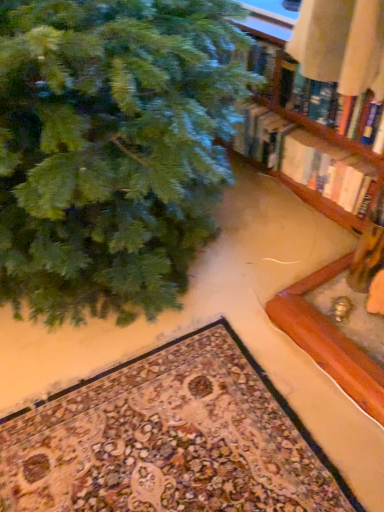
Question: Is point (215, 369) closer or farther from the camera than point (367, 103)?

Choices:
 (A) closer
 (B) farther

Answer: (B)

Question: Is carpeted mat at lower center spatially inside wooden bookshelf at upper right, or outside of it?

Choices:
 (A) inside
 (B) outside

Answer: (B)

Question: Which is farther from the carpeted mat at lower center?

Choices:
 (A) wooden bookshelf at upper right
 (B) green matte christmas tree at upper left
 (C) hardcover book at upper right

Answer: (A)

Question: Which of these objects is positioned closest to the hardcover book at upper right?

Choices:
 (A) wooden bookshelf at upper right
 (B) green matte christmas tree at upper left
 (C) carpeted mat at lower center

Answer: (A)